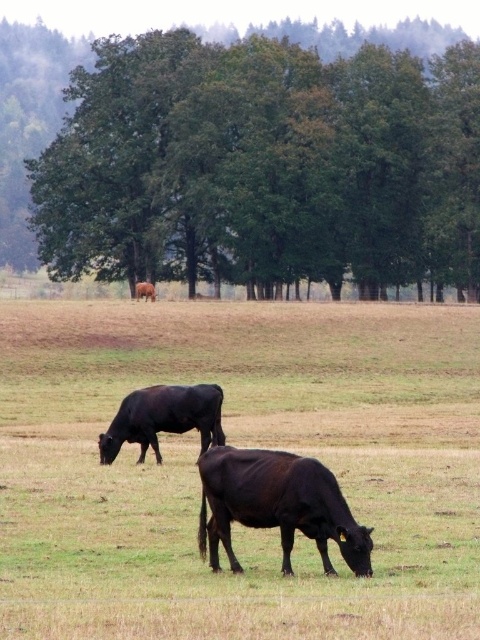
You are a farmer checking the field. You notice the shiny dark brown bull at lower center and the brown matte cow at center. Which animal appears smaller in width when viewed from your position?

The shiny dark brown bull at lower center has a lesser width compared to the brown matte cow at center, so it appears smaller in width.